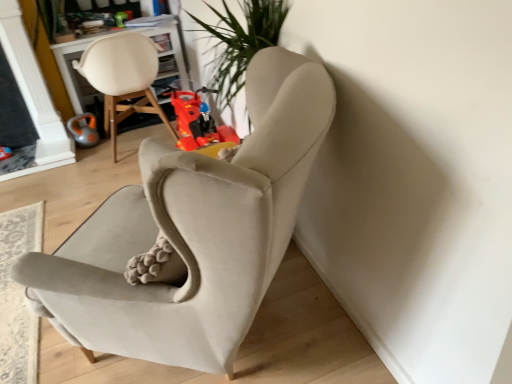
Locate an element on the screen. This screenshot has width=512, height=384. vacant region under matte white chair at upper left, marked as the 1th chair in a left-to-right arrangement (from a real-world perspective) is located at coordinates (130, 148).